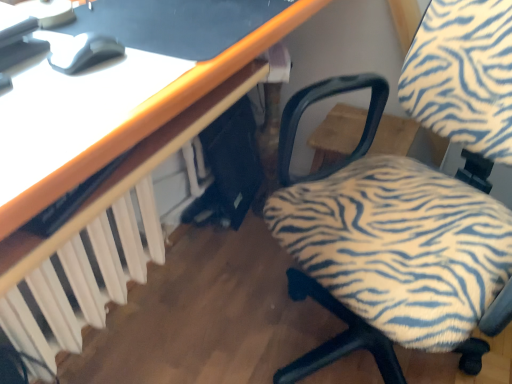
Question: Does matte gray mouse at upper left come behind white plastic radiator at lower left?

Choices:
 (A) yes
 (B) no

Answer: (B)

Question: Can you confirm if matte gray mouse at upper left is thinner than white plastic radiator at lower left?

Choices:
 (A) no
 (B) yes

Answer: (B)

Question: Can you confirm if matte gray mouse at upper left is shorter than white plastic radiator at lower left?

Choices:
 (A) yes
 (B) no

Answer: (A)

Question: Is matte gray mouse at upper left wider than white plastic radiator at lower left?

Choices:
 (A) no
 (B) yes

Answer: (A)

Question: Is matte gray mouse at upper left directly adjacent to white plastic radiator at lower left?

Choices:
 (A) no
 (B) yes

Answer: (A)

Question: Considering the positions of matte gray mouse at upper left and zebra-patterned fabric chair at center-right in the image, is matte gray mouse at upper left bigger or smaller than zebra-patterned fabric chair at center-right?

Choices:
 (A) big
 (B) small

Answer: (B)

Question: Is matte gray mouse at upper left spatially inside zebra-patterned fabric chair at center-right, or outside of it?

Choices:
 (A) inside
 (B) outside

Answer: (B)

Question: From a real-world perspective, relative to zebra-patterned fabric chair at center-right, is matte gray mouse at upper left vertically above or below?

Choices:
 (A) above
 (B) below

Answer: (A)

Question: From the image's perspective, relative to zebra-patterned fabric chair at center-right, is matte gray mouse at upper left above or below?

Choices:
 (A) above
 (B) below

Answer: (A)

Question: From a real-world perspective, relative to zebra-patterned fabric chair at center-right, is white plastic radiator at lower left vertically above or below?

Choices:
 (A) above
 (B) below

Answer: (B)

Question: Looking at their shapes, would you say white plastic radiator at lower left is wider or thinner than zebra-patterned fabric chair at center-right?

Choices:
 (A) thin
 (B) wide

Answer: (A)

Question: Considering the positions of white plastic radiator at lower left and zebra-patterned fabric chair at center-right in the image, is white plastic radiator at lower left bigger or smaller than zebra-patterned fabric chair at center-right?

Choices:
 (A) small
 (B) big

Answer: (A)

Question: Relative to zebra-patterned fabric chair at center-right, is white plastic radiator at lower left in front or behind?

Choices:
 (A) behind
 (B) front

Answer: (A)

Question: Looking at the image, does zebra-patterned fabric chair at center-right seem bigger or smaller compared to white plastic radiator at lower left?

Choices:
 (A) big
 (B) small

Answer: (A)

Question: From a real-world perspective, is zebra-patterned fabric chair at center-right above or below white plastic radiator at lower left?

Choices:
 (A) above
 (B) below

Answer: (A)